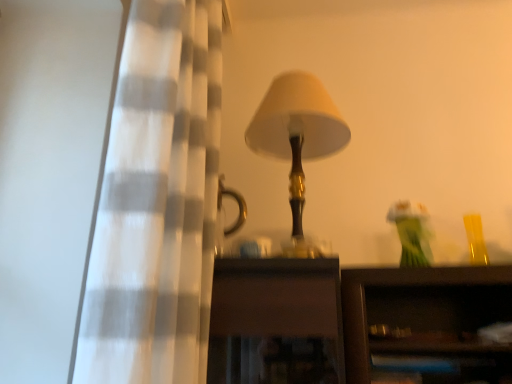
Question: Does translucent glass vase at upper right come in front of matte gold lamp at center?

Choices:
 (A) no
 (B) yes

Answer: (A)

Question: Considering the relative sizes of translucent glass vase at upper right and matte gold lamp at center in the image provided, is translucent glass vase at upper right bigger than matte gold lamp at center?

Choices:
 (A) no
 (B) yes

Answer: (A)

Question: Does translucent glass vase at upper right have a lesser width compared to matte gold lamp at center?

Choices:
 (A) yes
 (B) no

Answer: (A)

Question: From the image's perspective, is translucent glass vase at upper right over matte gold lamp at center?

Choices:
 (A) no
 (B) yes

Answer: (A)

Question: Considering the relative sizes of translucent glass vase at upper right and matte gold lamp at center in the image provided, is translucent glass vase at upper right wider than matte gold lamp at center?

Choices:
 (A) no
 (B) yes

Answer: (A)

Question: Is matte gold lamp at center to the left or to the right of translucent glass vase at upper right in the image?

Choices:
 (A) left
 (B) right

Answer: (A)

Question: From the image's perspective, is matte gold lamp at center located above or below translucent glass vase at upper right?

Choices:
 (A) below
 (B) above

Answer: (B)

Question: Is matte gold lamp at center taller or shorter than translucent glass vase at upper right?

Choices:
 (A) short
 (B) tall

Answer: (B)

Question: Is point (279, 117) closer or farther from the camera than point (422, 238)?

Choices:
 (A) farther
 (B) closer

Answer: (A)

Question: Considering their positions, is white checkered curtain at left located in front of or behind matte gold lamp at center?

Choices:
 (A) behind
 (B) front

Answer: (B)

Question: From the image's perspective, is white checkered curtain at left positioned above or below matte gold lamp at center?

Choices:
 (A) above
 (B) below

Answer: (A)

Question: From a real-world perspective, relative to matte gold lamp at center, is white checkered curtain at left vertically above or below?

Choices:
 (A) above
 (B) below

Answer: (A)

Question: In terms of width, does white checkered curtain at left look wider or thinner when compared to matte gold lamp at center?

Choices:
 (A) thin
 (B) wide

Answer: (A)

Question: Considering the relative positions of white checkered curtain at left and translucent glass vase at upper right in the image provided, is white checkered curtain at left to the left or to the right of translucent glass vase at upper right?

Choices:
 (A) right
 (B) left

Answer: (B)

Question: Which is correct: white checkered curtain at left is inside translucent glass vase at upper right, or outside of it?

Choices:
 (A) outside
 (B) inside

Answer: (A)